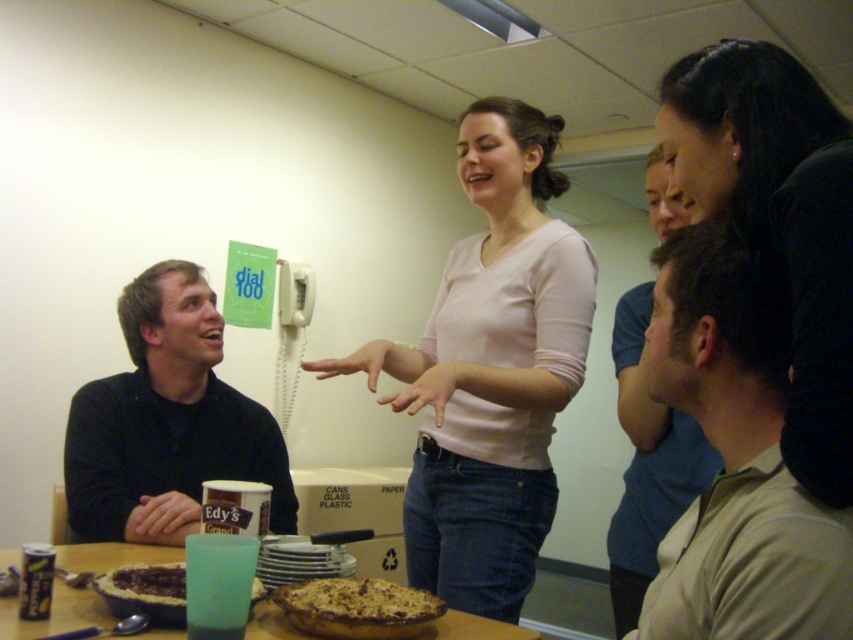
Does pink matte shirt at center lie behind chocolate glazed pie at table center?

Yes.

Which is more to the left, pink matte shirt at center or chocolate glazed pie at table center?

chocolate glazed pie at table center is more to the left.

Who is more distant from viewer, [538,376] or [123,566]?

Positioned behind is point [538,376].

At what (x,y) coordinates should I click in order to perform the action: click on pink matte shirt at center. Please return your answer as a coordinate pair (x, y). The image size is (853, 640). Looking at the image, I should click on (490, 369).

Is point (392, 356) closer to camera compared to point (200, 390)?

Yes.

Who is taller, pink matte shirt at center or black sweater at left?

pink matte shirt at center is taller.

Where is `pink matte shirt at center`? Image resolution: width=853 pixels, height=640 pixels. pink matte shirt at center is located at coordinates (490, 369).

Who is taller, beige cotton shirt at center or golden crumbly pie at center?

With more height is beige cotton shirt at center.

Who is higher up, beige cotton shirt at center or golden crumbly pie at center?

beige cotton shirt at center

Which is behind, point (757, 433) or point (318, 580)?

Point (318, 580)

Identify the location of beige cotton shirt at center. The image size is (853, 640). (735, 460).